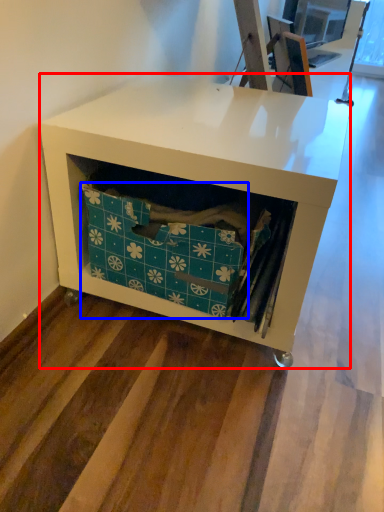
Question: Which object is further to the camera taking this photo, desk (highlighted by a red box) or storage box (highlighted by a blue box)?

Choices:
 (A) desk
 (B) storage box

Answer: (B)